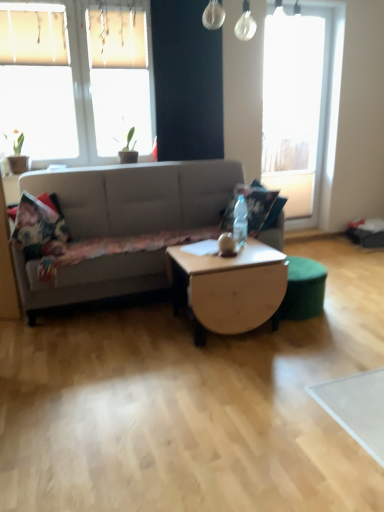
Where is `vacant area to the right of wooden coffee table at center`? The height and width of the screenshot is (512, 384). vacant area to the right of wooden coffee table at center is located at coordinates (316, 337).